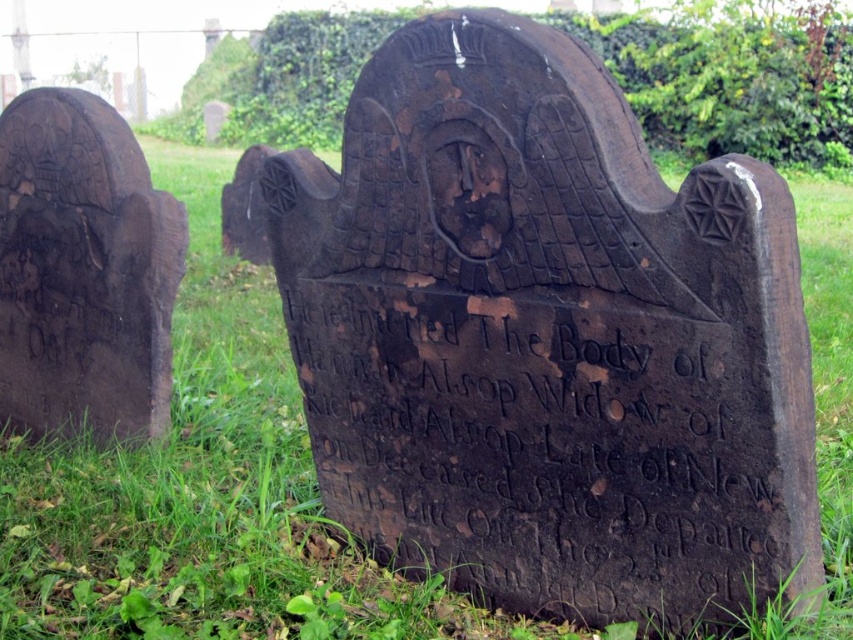
Can you confirm if black stone inscription at center is thinner than dark brown wood at left?

No, black stone inscription at center is not thinner than dark brown wood at left.

Does black stone inscription at center have a lesser height compared to dark brown wood at left?

Indeed, black stone inscription at center has a lesser height compared to dark brown wood at left.

The width and height of the screenshot is (853, 640). I want to click on black stone inscription at center, so coord(544,445).

Where is `black stone inscription at center`? The image size is (853, 640). black stone inscription at center is located at coordinates (544, 445).